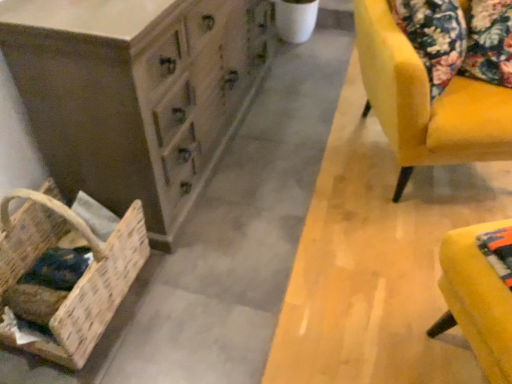
Question: Considering the positions of point (379, 11) and point (148, 89), is point (379, 11) closer or farther from the camera than point (148, 89)?

Choices:
 (A) closer
 (B) farther

Answer: (B)

Question: From a real-world perspective, is velvet yellow chair at right positioned above or below wooden chest of drawers at lower left?

Choices:
 (A) below
 (B) above

Answer: (B)

Question: Which object is the closest to the woven wood basket at lower left?

Choices:
 (A) wooden chest of drawers at lower left
 (B) yellow fabric ottoman at lower right
 (C) velvet yellow chair at right

Answer: (A)

Question: Which object is positioned farthest from the yellow fabric ottoman at lower right?

Choices:
 (A) wooden chest of drawers at lower left
 (B) woven wood basket at lower left
 (C) velvet yellow chair at right

Answer: (B)